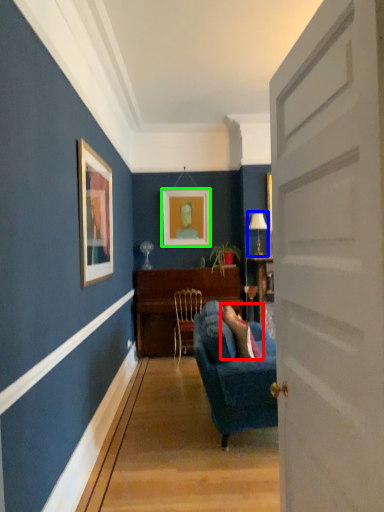
Question: Considering the real-world distances, which object is closest to person (highlighted by a red box)? lamp (highlighted by a blue box) or picture frame (highlighted by a green box).

Choices:
 (A) lamp
 (B) picture frame

Answer: (B)